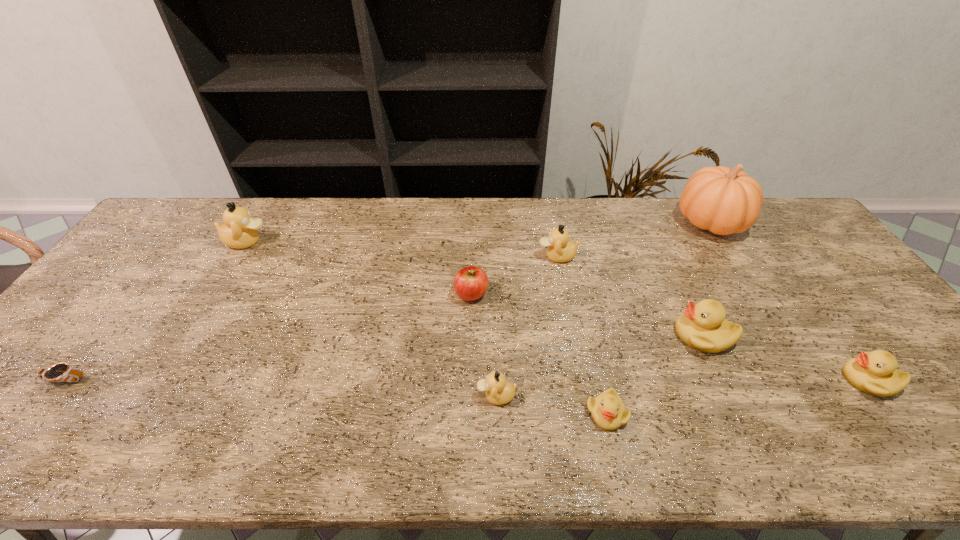
At what (x,y) coordinates should I click in order to perform the action: click on free space between the rightmost yellow duckling and the eighth shortest object. Please return your answer as a coordinate pair (x, y). This screenshot has width=960, height=540. Looking at the image, I should click on (558, 310).

Find the location of a particular element. vacant area that lies between the tallest object and the black watch is located at coordinates (389, 301).

In order to click on unoccupied position between the shortest object and the red apple in this screenshot , I will do `click(269, 336)`.

Identify the location of the fourth closest object to the rightmost duckling. The width and height of the screenshot is (960, 540). (560, 249).

Locate an element on the screen. Image resolution: width=960 pixels, height=540 pixels. the closest object to the leftmost object is located at coordinates (240, 230).

Identify which duckling is the fourth closest to the second biggest tan duckling. Please provide its 2D coordinates. Your answer should be formatted as a tuple, i.e. [(x, y)], where the tuple contains the x and y coordinates of a point satisfying the conditions above.

[(875, 373)]

Select which duckling appears as the fourth closest to the rightmost yellow duckling. Please provide its 2D coordinates. Your answer should be formatted as a tuple, i.e. [(x, y)], where the tuple contains the x and y coordinates of a point satisfying the conditions above.

[(498, 391)]

The height and width of the screenshot is (540, 960). I want to click on tan duckling object that ranks as the closest to the second duckling from right to left, so click(x=560, y=249).

Select which tan duckling is the second closest to the red apple. Please provide its 2D coordinates. Your answer should be formatted as a tuple, i.e. [(x, y)], where the tuple contains the x and y coordinates of a point satisfying the conditions above.

[(498, 391)]

Locate which yellow duckling ranks third in proximity to the nearest tan duckling. Please provide its 2D coordinates. Your answer should be formatted as a tuple, i.e. [(x, y)], where the tuple contains the x and y coordinates of a point satisfying the conditions above.

[(875, 373)]